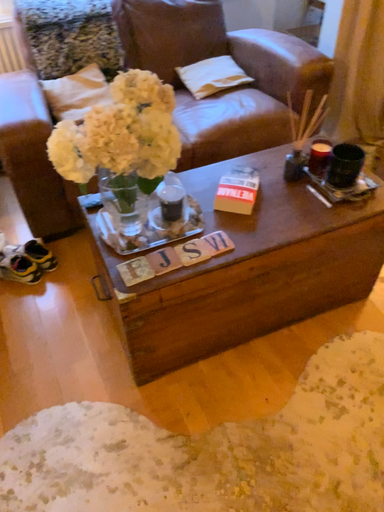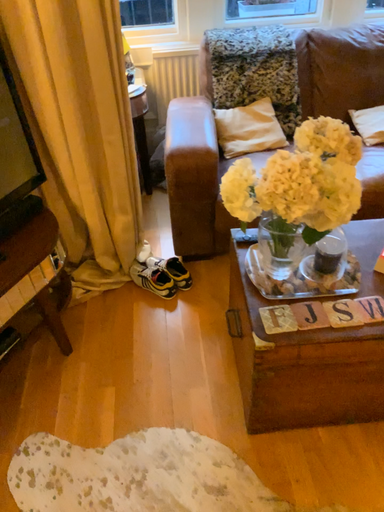
Question: How did the camera likely rotate when shooting the video?

Choices:
 (A) rotated left
 (B) rotated right

Answer: (A)